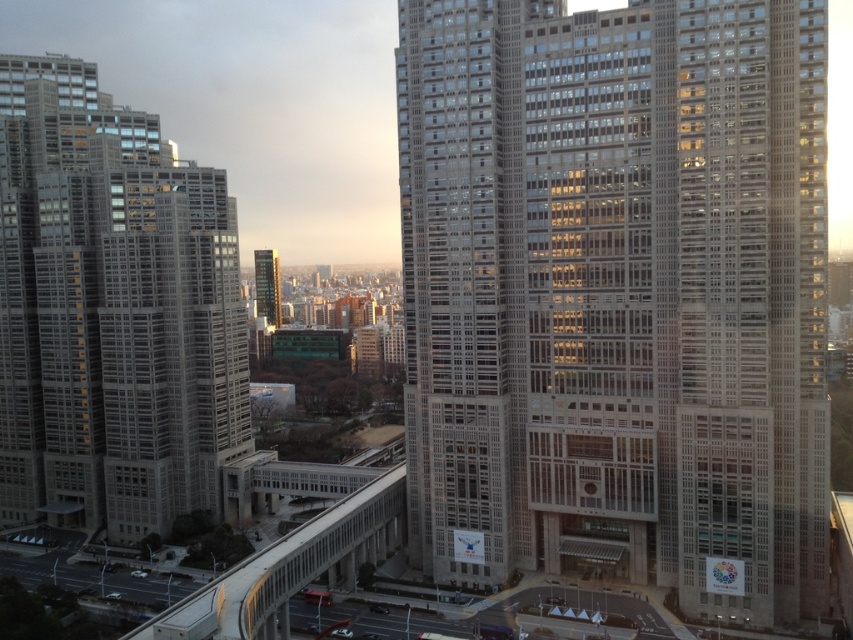
You are an urban planner assessing the spatial layout of the city. Given the beige concrete building at center and the gray concrete skyscraper at left, which one has a narrower structure?

The beige concrete building at center has a narrower structure than the gray concrete skyscraper at left because its width is less than the latter.